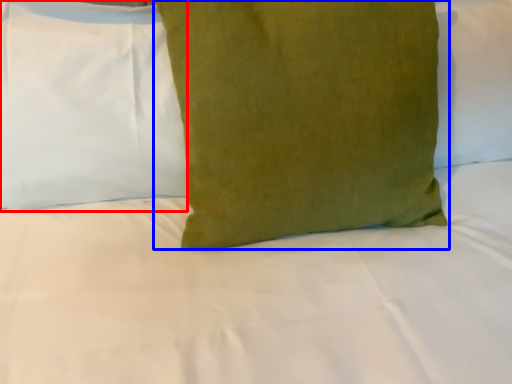
Question: Which object is closer to the camera taking this photo, pillow (highlighted by a red box) or pillow (highlighted by a blue box)?

Choices:
 (A) pillow
 (B) pillow

Answer: (B)